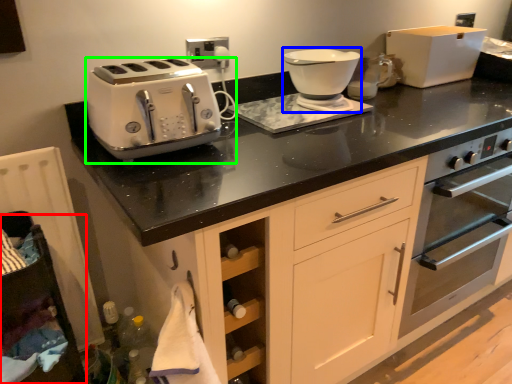
Question: Which is nearer to the cabinetry (highlighted by a red box)? food processor (highlighted by a blue box) or toaster (highlighted by a green box).

Choices:
 (A) food processor
 (B) toaster

Answer: (B)